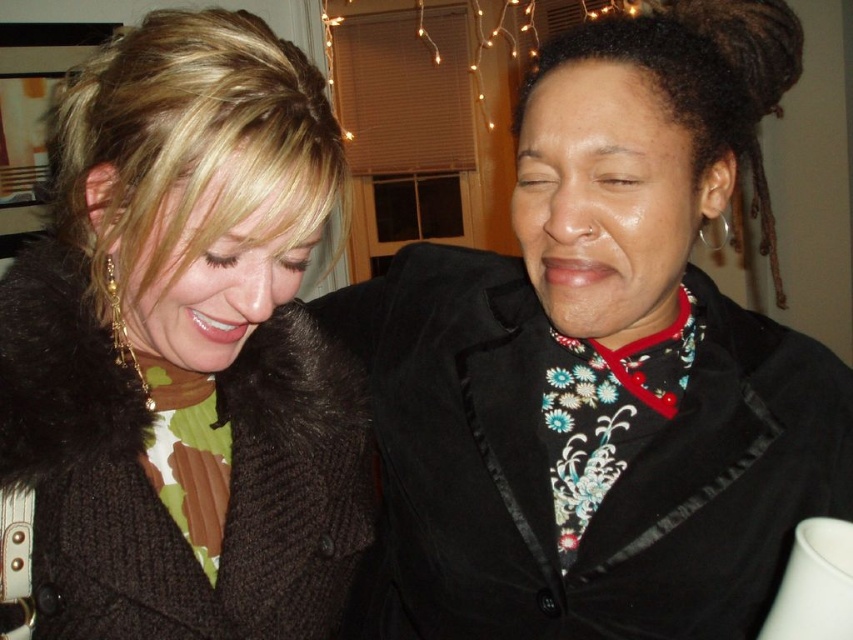
Question: Which point is farther to the camera?

Choices:
 (A) pyautogui.click(x=701, y=204)
 (B) pyautogui.click(x=311, y=499)

Answer: (B)

Question: Is velvet black blazer at center in front of brown fuzzy coat at left?

Choices:
 (A) yes
 (B) no

Answer: (B)

Question: Which of the following is the farthest from the observer?

Choices:
 (A) (78, 161)
 (B) (457, 282)

Answer: (B)

Question: In this image, where is velvet black blazer at center located relative to brown fuzzy coat at left?

Choices:
 (A) below
 (B) above

Answer: (A)

Question: Which of the following is the closest to the observer?

Choices:
 (A) (289, 225)
 (B) (647, 365)

Answer: (A)

Question: Does velvet black blazer at center lie behind brown fuzzy coat at left?

Choices:
 (A) no
 (B) yes

Answer: (B)